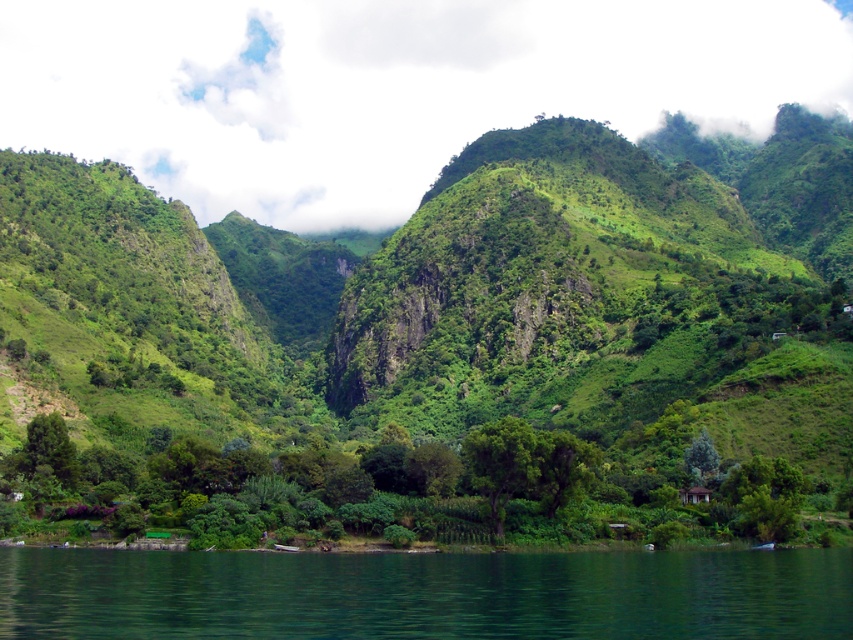
Is green leafy mountain at center bigger than white fluffy cloud at upper center?

Indeed, green leafy mountain at center has a larger size compared to white fluffy cloud at upper center.

Measure the distance between green leafy mountain at center and camera.

green leafy mountain at center and camera are 93.37 meters apart.

You are a GUI agent. You are given a task and a screenshot of the screen. Output one action in this format:
    pyautogui.click(x=<x>, y=<y>)
    Task: Click on the green leafy mountain at center
    This screenshot has height=640, width=853.
    Given the screenshot: What is the action you would take?
    pyautogui.click(x=444, y=328)

Is point (764, 490) farther from viewer compared to point (105, 570)?

That is True.

The width and height of the screenshot is (853, 640). Find the location of `green leafy trees at center`. green leafy trees at center is located at coordinates (393, 490).

Identify the location of green leafy trees at center. (393, 490).

Between white fluffy cloud at upper center and green leafy trees at center, which one has less height?

Standing shorter between the two is green leafy trees at center.

Which is behind, point (74, 108) or point (523, 429)?

Point (74, 108)

Find the location of a particular element. white fluffy cloud at upper center is located at coordinates (386, 88).